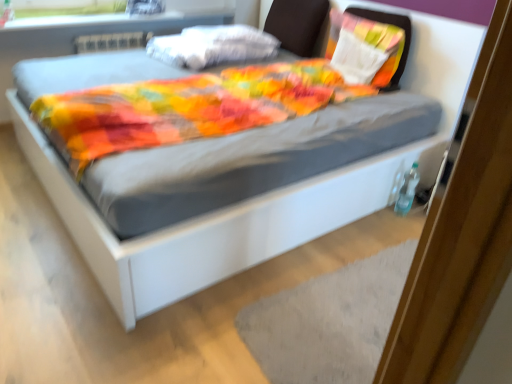
Question: Does brown fabric headboard at upper center have a larger size compared to gray textured mat at lower center?

Choices:
 (A) yes
 (B) no

Answer: (A)

Question: Is brown fabric headboard at upper center facing away from gray textured mat at lower center?

Choices:
 (A) no
 (B) yes

Answer: (A)

Question: Does brown fabric headboard at upper center lie behind gray textured mat at lower center?

Choices:
 (A) yes
 (B) no

Answer: (A)

Question: Is brown fabric headboard at upper center surrounding gray textured mat at lower center?

Choices:
 (A) yes
 (B) no

Answer: (B)

Question: Does brown fabric headboard at upper center lie in front of gray textured mat at lower center?

Choices:
 (A) yes
 (B) no

Answer: (B)

Question: From the image's perspective, does brown fabric headboard at upper center appear lower than gray textured mat at lower center?

Choices:
 (A) no
 (B) yes

Answer: (A)

Question: Is the position of white cotton pillow at upper center, which ranks as the second pillow in right-to-left order, less distant than that of matte plastic window sill at upper left?

Choices:
 (A) yes
 (B) no

Answer: (A)

Question: Is white cotton pillow at upper center, which is the first pillow in left-to-right order, facing away from matte plastic window sill at upper left?

Choices:
 (A) yes
 (B) no

Answer: (B)

Question: Can you confirm if white cotton pillow at upper center, which ranks as the second pillow in right-to-left order, is taller than matte plastic window sill at upper left?

Choices:
 (A) no
 (B) yes

Answer: (B)

Question: Can you confirm if white cotton pillow at upper center, which ranks as the second pillow in right-to-left order, is thinner than matte plastic window sill at upper left?

Choices:
 (A) yes
 (B) no

Answer: (B)

Question: Can you confirm if white cotton pillow at upper center, which ranks as the second pillow in right-to-left order, is bigger than matte plastic window sill at upper left?

Choices:
 (A) no
 (B) yes

Answer: (B)

Question: Does white cotton pillow at upper center, which is the first pillow in left-to-right order, appear on the left side of matte plastic window sill at upper left?

Choices:
 (A) no
 (B) yes

Answer: (A)

Question: Is gray textured mat at lower center closer to camera compared to brown fabric headboard at upper center?

Choices:
 (A) no
 (B) yes

Answer: (B)